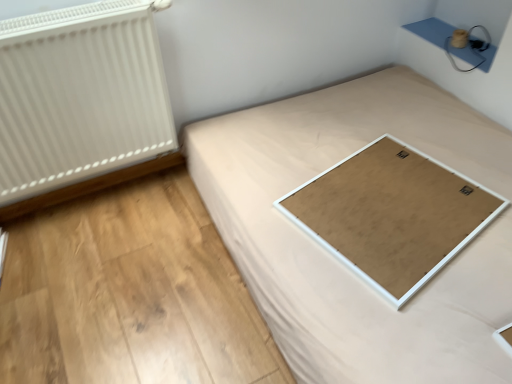
Find the location of a particular element. vacant region below white matte board at center (from a real-world perspective) is located at coordinates (394, 206).